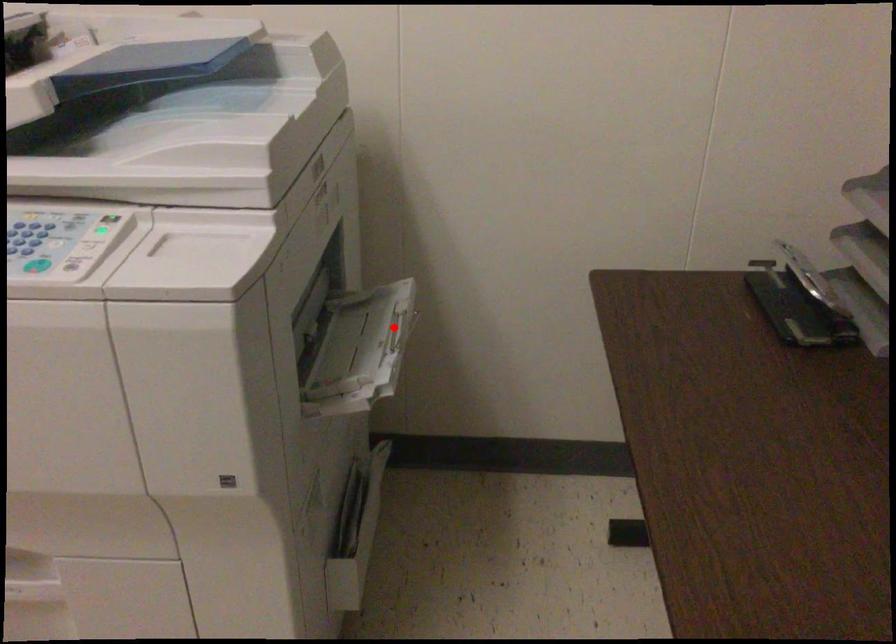
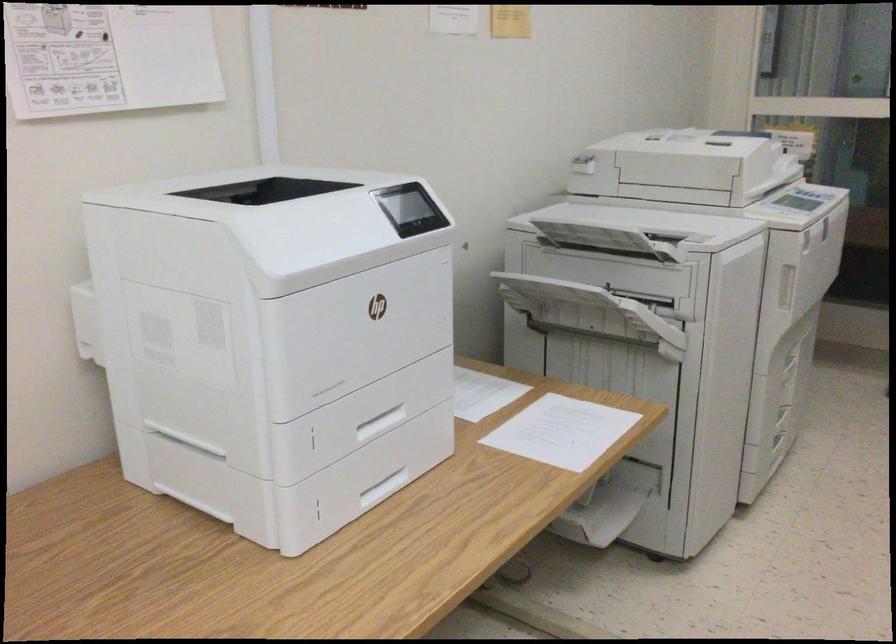
Question: I am providing you with two images of the same scene from different viewpoints. A red point is marked on the first image. At the location where the point appears in image 1, is it still visible in image 2?

Choices:
 (A) Yes
 (B) No

Answer: (B)